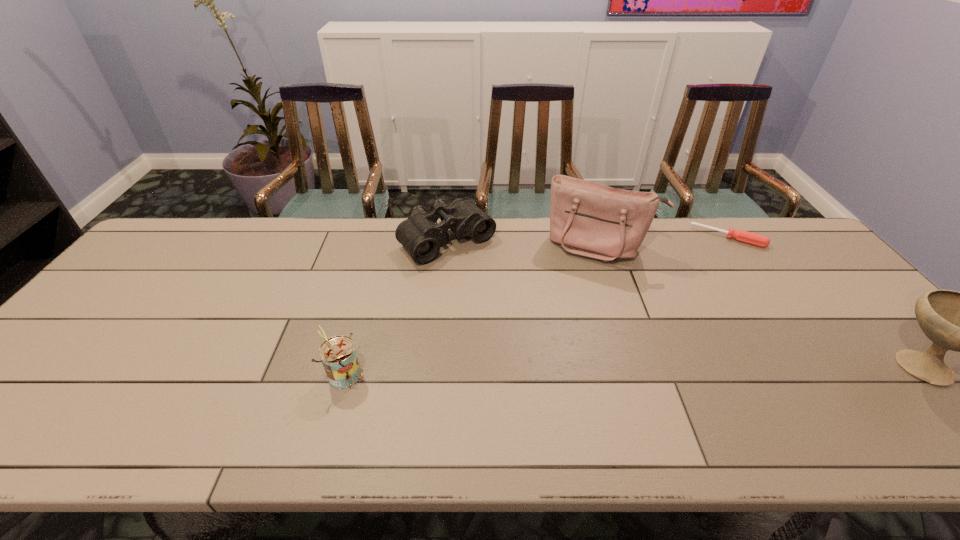
Where is `vacant space at the near right corner of the desktop`? The width and height of the screenshot is (960, 540). vacant space at the near right corner of the desktop is located at coordinates (922, 390).

Locate an element on the screen. unoccupied area between the shortest object and the shoulder bag is located at coordinates 663,242.

This screenshot has height=540, width=960. Find the location of `free space between the third tallest object and the third object from left to right`. free space between the third tallest object and the third object from left to right is located at coordinates (473, 310).

This screenshot has height=540, width=960. I want to click on vacant area that lies between the tallest object and the leftmost object, so click(473, 310).

Where is `vacant space that's between the third object from right to left and the leftmost object`? The width and height of the screenshot is (960, 540). vacant space that's between the third object from right to left and the leftmost object is located at coordinates (473, 310).

Select which object is the fourth closest to the binoculars. Please provide its 2D coordinates. Your answer should be formatted as a tuple, i.e. [(x, y)], where the tuple contains the x and y coordinates of a point satisfying the conditions above.

[(958, 321)]

I want to click on the closest object to the second object from left to right, so pyautogui.click(x=589, y=219).

What are the coordinates of `vacant space that satisfies the following two spatial constraints: 1. on the back side of the fourth object from left to right; 2. on the right side of the second object from left to right` in the screenshot? It's located at (447, 237).